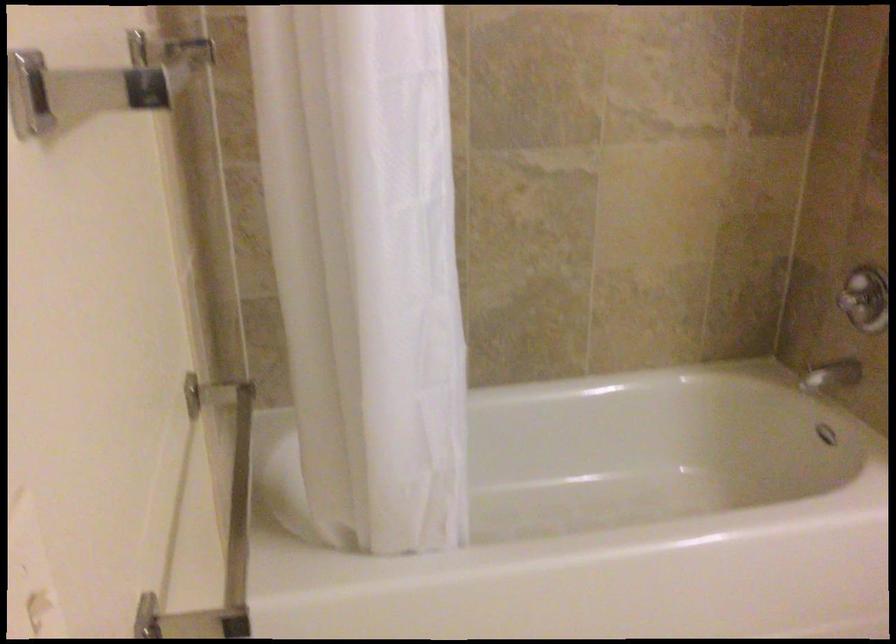
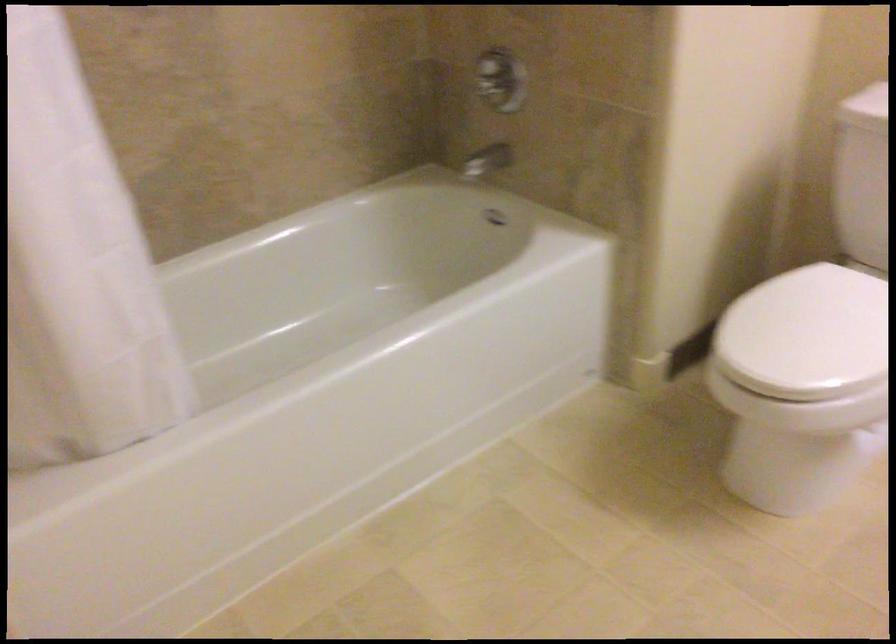
Question: How did the camera likely rotate?

Choices:
 (A) Left
 (B) Right
 (C) Up
 (D) Down

Answer: (B)